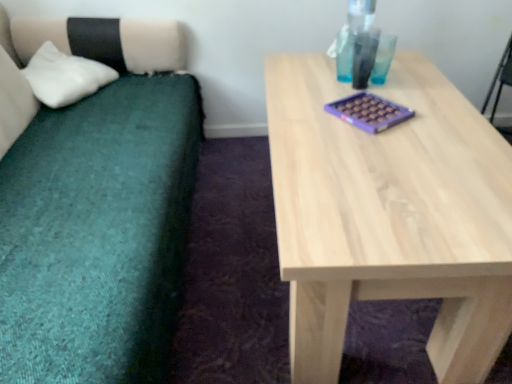
Question: Is white soft pillow at left with natural wood table at center?

Choices:
 (A) no
 (B) yes

Answer: (A)

Question: Does white soft pillow at left turn towards natural wood table at center?

Choices:
 (A) no
 (B) yes

Answer: (A)

Question: From the image's perspective, is white soft pillow at left located above natural wood table at center?

Choices:
 (A) yes
 (B) no

Answer: (A)

Question: Is white soft pillow at left at the right side of natural wood table at center?

Choices:
 (A) no
 (B) yes

Answer: (A)

Question: Can you confirm if white soft pillow at left is smaller than natural wood table at center?

Choices:
 (A) yes
 (B) no

Answer: (A)

Question: Are white soft pillow at left and natural wood table at center located far from each other?

Choices:
 (A) no
 (B) yes

Answer: (B)

Question: Can you confirm if natural wood table at center is thinner than teal fabric couch at left?

Choices:
 (A) no
 (B) yes

Answer: (A)

Question: Does natural wood table at center have a greater height compared to teal fabric couch at left?

Choices:
 (A) no
 (B) yes

Answer: (A)

Question: Is natural wood table at center further to camera compared to teal fabric couch at left?

Choices:
 (A) yes
 (B) no

Answer: (A)

Question: Does natural wood table at center have a lesser height compared to teal fabric couch at left?

Choices:
 (A) yes
 (B) no

Answer: (A)

Question: Is natural wood table at center turned away from teal fabric couch at left?

Choices:
 (A) no
 (B) yes

Answer: (A)

Question: From the image's perspective, is natural wood table at center on top of teal fabric couch at left?

Choices:
 (A) yes
 (B) no

Answer: (B)

Question: Is teal fabric couch at left surrounding white soft pillow at left?

Choices:
 (A) no
 (B) yes

Answer: (B)